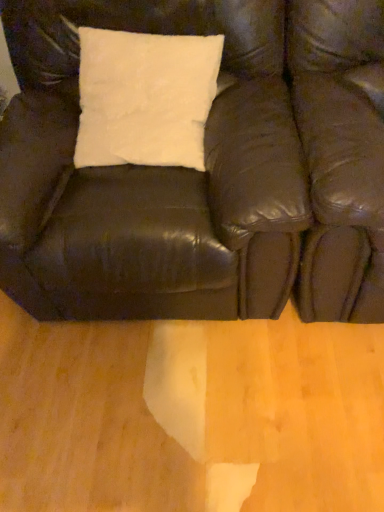
This screenshot has height=512, width=384. I want to click on matte black leather couch at center, so click(x=205, y=173).

Image resolution: width=384 pixels, height=512 pixels. What do you see at coordinates (205, 173) in the screenshot?
I see `matte black leather couch at center` at bounding box center [205, 173].

Identify the location of matte black leather couch at center. (205, 173).